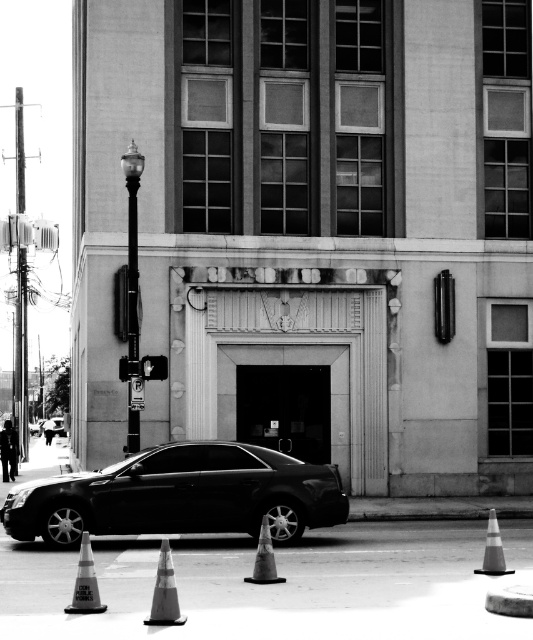
Can you confirm if orange reflective traffic cone at lower center is thinner than smooth gray cone at center?

Yes.

Find the location of `orange reflective traffic cone at lower center`. orange reflective traffic cone at lower center is located at coordinates (165, 593).

Which is more to the right, reflective orange cone at lower left or smooth gray cone at center?

smooth gray cone at center is more to the right.

Which is in front, point (88, 596) or point (255, 572)?

Positioned in front is point (88, 596).

Does point (86, 566) come behind point (269, 536)?

No.

Locate an element on the screen. The width and height of the screenshot is (533, 640). reflective orange cone at lower left is located at coordinates (85, 582).

Between orange reflective traffic cone at lower center and reflective orange cone at lower left, which one is positioned lower?

reflective orange cone at lower left

Does orange reflective traffic cone at lower center appear on the right side of reflective orange cone at lower left?

Correct, you'll find orange reflective traffic cone at lower center to the right of reflective orange cone at lower left.

Is point (174, 586) less distant than point (90, 557)?

Yes, point (174, 586) is in front of point (90, 557).

I want to click on orange reflective traffic cone at lower center, so click(165, 593).